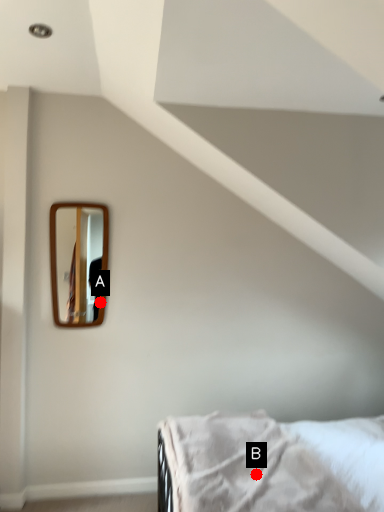
Question: Two points are circled on the image, labeled by A and B beside each circle. Which point appears farthest from the camera in this image?

Choices:
 (A) A is further
 (B) B is further

Answer: (A)